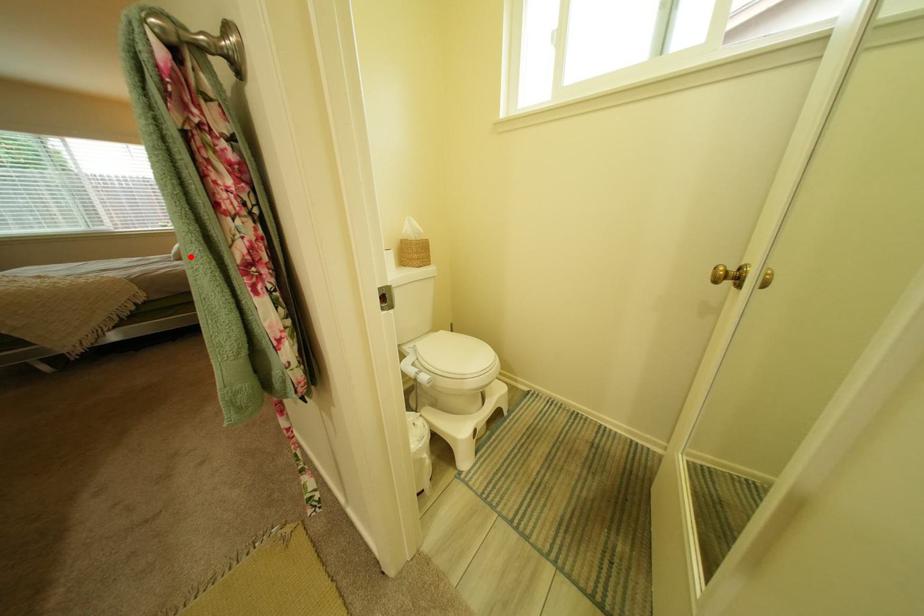
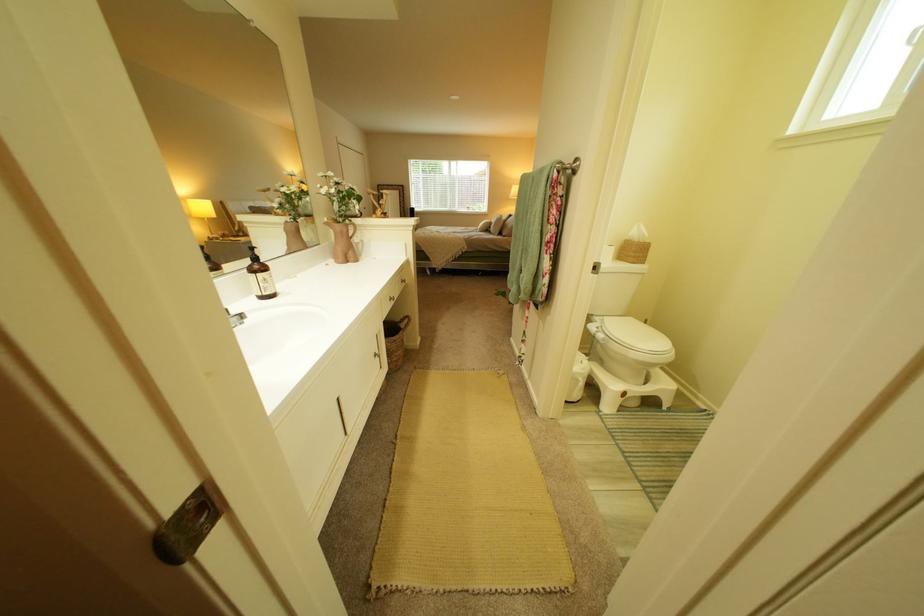
Locate, in the second image, the point that corresponds to the highlighted location in the first image.

(495, 230)